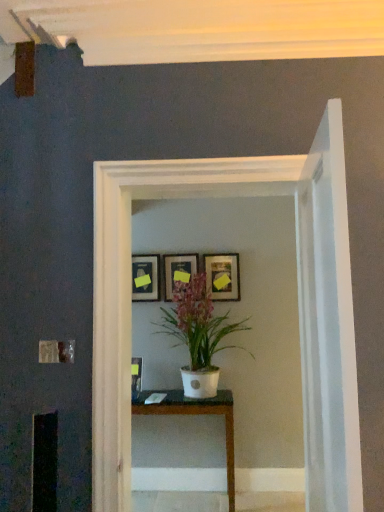
Where is `matte black picture frame at center, the third picture frame viewed from the left`? matte black picture frame at center, the third picture frame viewed from the left is located at coordinates (222, 276).

Locate an element on the screen. The height and width of the screenshot is (512, 384). white glossy glass door at center is located at coordinates (130, 289).

How much space does matte black picture frame at upper center, which is counted as the 1th picture frame, starting from the left, occupy horizontally?

matte black picture frame at upper center, which is counted as the 1th picture frame, starting from the left, is 2.70 inches in width.

You are a GUI agent. You are given a task and a screenshot of the screen. Output one action in this format:
    pyautogui.click(x=<x>, y=<y>)
    Task: Click on the white glossy table at center
    This screenshot has height=512, width=384.
    Given the screenshot: What is the action you would take?
    pyautogui.click(x=197, y=415)

Image resolution: width=384 pixels, height=512 pixels. Describe the element at coordinates (197, 415) in the screenshot. I see `white glossy table at center` at that location.

Locate an element on the screen. This screenshot has width=384, height=512. matte black picture frame at center, the first picture frame from the right is located at coordinates (222, 276).

Looking at the image, does matte black picture frame at upper center, which is counted as the 1th picture frame, starting from the left, seem bigger or smaller compared to white matte pot at center?

Considering their sizes, matte black picture frame at upper center, which is counted as the 1th picture frame, starting from the left, takes up less space than white matte pot at center.

Which object is closer to the camera, matte black picture frame at upper center, the 3th picture frame positioned from the right, or white matte pot at center?

Positioned in front is white matte pot at center.

Is matte black picture frame at upper center, which is counted as the 1th picture frame, starting from the left, oriented away from white matte pot at center?

No, matte black picture frame at upper center, which is counted as the 1th picture frame, starting from the left,'s orientation is not away from white matte pot at center.

From a real-world perspective, relative to white matte pot at center, is matte black picture frame at center, the first picture frame from the right, vertically above or below?

matte black picture frame at center, the first picture frame from the right, is situated higher than white matte pot at center in the real world.

Is white matte pot at center a part of matte black picture frame at center, the first picture frame from the right?

Definitely not — white matte pot at center is not inside matte black picture frame at center, the first picture frame from the right.

Between point (216, 295) and point (191, 316), which one is positioned behind?

Point (216, 295)

Who is bigger, matte black picture frame at center, the first picture frame from the right, or white matte pot at center?

With larger size is white matte pot at center.

In terms of width, does matte black picture frame at upper center, the 3th picture frame positioned from the right, look wider or thinner when compared to white glossy glass door at center?

In the image, matte black picture frame at upper center, the 3th picture frame positioned from the right, appears to be more narrow than white glossy glass door at center.

Can white glossy glass door at center be found inside matte black picture frame at upper center, which is counted as the 1th picture frame, starting from the left?

No, white glossy glass door at center is not a part of matte black picture frame at upper center, which is counted as the 1th picture frame, starting from the left.

How many degrees apart are the facing directions of matte black picture frame at upper center, which is counted as the 1th picture frame, starting from the left, and white glossy glass door at center?

They differ by 0.791 degrees in their facing directions.

Who is taller, matte black picture frame at upper center, which is counted as the 1th picture frame, starting from the left, or white glossy glass door at center?

white glossy glass door at center is taller.

Which is farther, (222, 284) or (209, 400)?

Point (222, 284)

Is matte black picture frame at center, the first picture frame from the right, closer to camera compared to white glossy table at center?

No.

From the image's perspective, is matte black picture frame at center, the first picture frame from the right, on white glossy table at center?

Yes, from the image's perspective, matte black picture frame at center, the first picture frame from the right, is over white glossy table at center.

In the image, is matte black picture frame at center, the third picture frame viewed from the left, on the left side or the right side of white glossy table at center?

matte black picture frame at center, the third picture frame viewed from the left, is to the right of white glossy table at center.

Based on their sizes in the image, would you say white glossy glass door at center is bigger or smaller than white matte pot at center?

In the image, white glossy glass door at center appears to be smaller than white matte pot at center.

Between white glossy glass door at center and white matte pot at center, which one has more height?

Standing taller between the two is white glossy glass door at center.

Is white glossy glass door at center beside white matte pot at center?

They are not placed beside each other.

Is white glossy glass door at center oriented away from white matte pot at center?

Yes.

Does point (214, 294) lie in front of point (132, 277)?

Yes, point (214, 294) is in front of point (132, 277).

Is matte black picture frame at upper center, which is counted as the 1th picture frame, starting from the left, located within matte black picture frame at center, the first picture frame from the right?

Actually, matte black picture frame at upper center, which is counted as the 1th picture frame, starting from the left, is outside matte black picture frame at center, the first picture frame from the right.

From the image's perspective, is matte black picture frame at center, the first picture frame from the right, beneath matte black picture frame at upper center, which is counted as the 1th picture frame, starting from the left?

No.

Could you tell me if matte black picture frame at center, the first picture frame from the right, is facing matte black picture frame at upper center, the 3th picture frame positioned from the right?

No, matte black picture frame at center, the first picture frame from the right, is not facing towards matte black picture frame at upper center, the 3th picture frame positioned from the right.

Considering the relative positions of white glossy table at center and white matte pot at center in the image provided, is white glossy table at center to the right of white matte pot at center from the viewer's perspective?

Incorrect, white glossy table at center is not on the right side of white matte pot at center.

From the image's perspective, which object appears higher, white glossy table at center or white matte pot at center?

From the image's view, white matte pot at center is above.

Considering the sizes of objects white glossy table at center and white matte pot at center in the image provided, who is thinner, white glossy table at center or white matte pot at center?

Thinner between the two is white glossy table at center.

Which is in front, point (234, 471) or point (164, 325)?

The point (234, 471) is closer.

I want to click on the 3rd picture frame behind the white matte pot at center, starting your count from the anchor, so click(x=145, y=278).

The height and width of the screenshot is (512, 384). There is a white matte pot at center. In order to click on the 3rd picture frame above it (from the image's perspective) in this screenshot , I will do `click(222, 276)`.

Based on their spatial positions, is white glossy glass door at center or matte wooden picture frame at center, which is the 2th picture frame from left to right, closer to matte black picture frame at center, the first picture frame from the right?

The object closer to matte black picture frame at center, the first picture frame from the right, is matte wooden picture frame at center, which is the 2th picture frame from left to right.

From the image, which object appears to be nearer to matte black picture frame at upper center, the 3th picture frame positioned from the right, white glossy glass door at center or matte wooden picture frame at center, which is the 2th picture frame from left to right?

matte wooden picture frame at center, which is the 2th picture frame from left to right, is positioned closer to the anchor matte black picture frame at upper center, the 3th picture frame positioned from the right.

Considering their positions, is matte black picture frame at upper center, the 3th picture frame positioned from the right, positioned further to matte black picture frame at center, the first picture frame from the right, than matte wooden picture frame at center, which is the second picture frame from right to left?

matte black picture frame at upper center, the 3th picture frame positioned from the right, lies further to matte black picture frame at center, the first picture frame from the right, than the other object.

Estimate the real-world distances between objects in this image. Which object is further from matte black picture frame at upper center, which is counted as the 1th picture frame, starting from the left, white matte pot at center or matte wooden picture frame at center, which is the second picture frame from right to left?

white matte pot at center.

Which object lies nearer to the anchor point white glossy table at center, matte black picture frame at upper center, which is counted as the 1th picture frame, starting from the left, or matte wooden picture frame at center, which is the second picture frame from right to left?

Based on the image, matte black picture frame at upper center, which is counted as the 1th picture frame, starting from the left, appears to be nearer to white glossy table at center.

From the image, which object appears to be nearer to matte wooden picture frame at center, which is the 2th picture frame from left to right, white matte pot at center or matte black picture frame at upper center, the 3th picture frame positioned from the right?

matte black picture frame at upper center, the 3th picture frame positioned from the right, lies closer to matte wooden picture frame at center, which is the 2th picture frame from left to right, than the other object.

Considering their positions, is white glossy glass door at center positioned closer to matte wooden picture frame at center, which is the second picture frame from right to left, than matte black picture frame at center, the third picture frame viewed from the left?

Based on the image, matte black picture frame at center, the third picture frame viewed from the left, appears to be nearer to matte wooden picture frame at center, which is the second picture frame from right to left.

Estimate the real-world distances between objects in this image. Which object is closer to white matte pot at center, white glossy table at center or matte wooden picture frame at center, which is the 2th picture frame from left to right?

matte wooden picture frame at center, which is the 2th picture frame from left to right, lies closer to white matte pot at center than the other object.

The width and height of the screenshot is (384, 512). I want to click on houseplant between matte black picture frame at center, the third picture frame viewed from the left, and white glossy table at center vertically, so click(198, 334).

Identify the location of houseplant between matte wooden picture frame at center, which is the 2th picture frame from left to right, and white glossy table at center from top to bottom. The image size is (384, 512). (198, 334).

You are a GUI agent. You are given a task and a screenshot of the screen. Output one action in this format:
    pyautogui.click(x=<x>, y=<y>)
    Task: Click on the houseplant between matte black picture frame at upper center, the 3th picture frame positioned from the right, and white glossy table at center in the up-down direction
    
    Given the screenshot: What is the action you would take?
    pyautogui.click(x=198, y=334)

Locate an element on the screen. The height and width of the screenshot is (512, 384). houseplant between white glossy glass door at center and white glossy table at center from front to back is located at coordinates (198, 334).